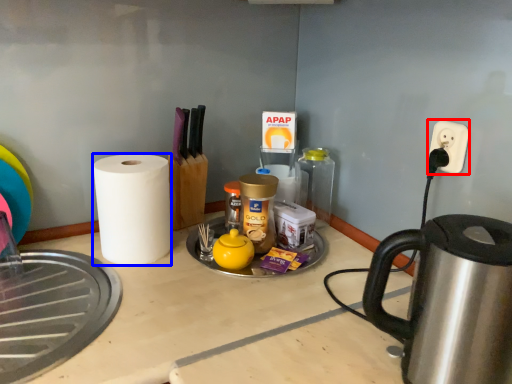
Question: Which object is closer to the camera taking this photo, electric outlet (highlighted by a red box) or paper towel (highlighted by a blue box)?

Choices:
 (A) electric outlet
 (B) paper towel

Answer: (A)